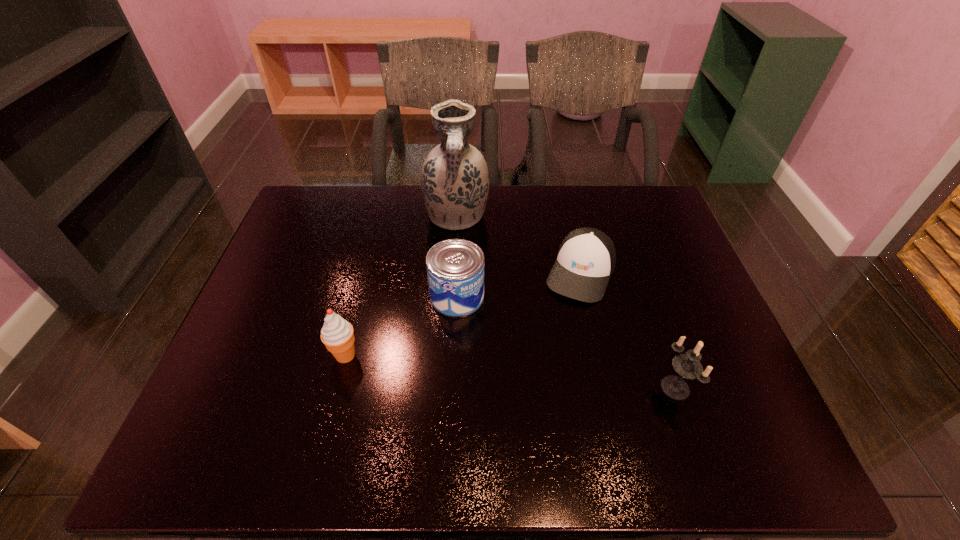
Where is `free spot between the vase and the rightmost object`? free spot between the vase and the rightmost object is located at coordinates (566, 302).

Locate an element on the screen. This screenshot has width=960, height=540. empty location between the fourth object from left to right and the rightmost object is located at coordinates (628, 330).

Where is `free area in between the second object from right to left and the tallest object`? The image size is (960, 540). free area in between the second object from right to left and the tallest object is located at coordinates (518, 245).

Find the location of a particular element. empty location between the tallest object and the candle holder is located at coordinates (566, 302).

This screenshot has height=540, width=960. I want to click on empty space between the tallest object and the second object from right to left, so click(x=518, y=245).

What are the coordinates of `free space between the candle holder and the farthest object` in the screenshot? It's located at (566, 302).

Identify the location of vacant space that is in between the nearest object and the icecream. (511, 371).

This screenshot has width=960, height=540. I want to click on unoccupied area between the tallest object and the candle holder, so click(566, 302).

Locate which object is the fourth closest to the vase. Please provide its 2D coordinates. Your answer should be formatted as a tuple, i.e. [(x, y)], where the tuple contains the x and y coordinates of a point satisfying the conditions above.

[(688, 366)]

Find the location of a particular element. object that is the fourth nearest to the can is located at coordinates (688, 366).